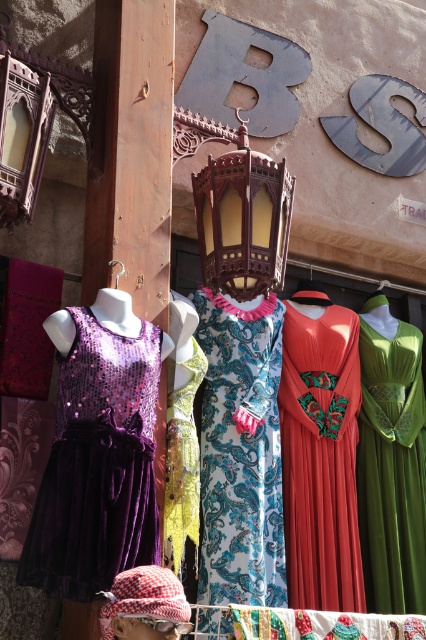
Looking at this image, you are a tailor trying to fit a customer into a dress. You have two options in the image, the green velvet dress at center and the yellow sequined dress at center. The customer mentions they prefer dresses that are wider at the hips. Which dress should you recommend?

The green velvet dress at center is wider than the yellow sequined dress at center, so it would be the better choice for the customer who prefers wider hips.

You are a customer in a boutique and want to try on the green velvet dress at center. The store uses a coordinate system where the bottom left corner is the origin. The coordinates of the dress are given as point 0.733, 0.920. If the wall is along the y axis and the floor is along the x axis, which direction should you walk to reach the dress?

The green velvet dress at center is located at coordinates 0.733 on the x axis and 0.920 on the y axis. Since the wall is along the y axis and the floor is along the x axis, you should walk towards the right and slightly forward to reach the dress.

You are a customer in a boutique and want to see the shiny red dress at center and the green velvet dress at center. Which dress is higher up in the display?

The shiny red dress at center is located above the green velvet dress at center, so it is higher up in the display.